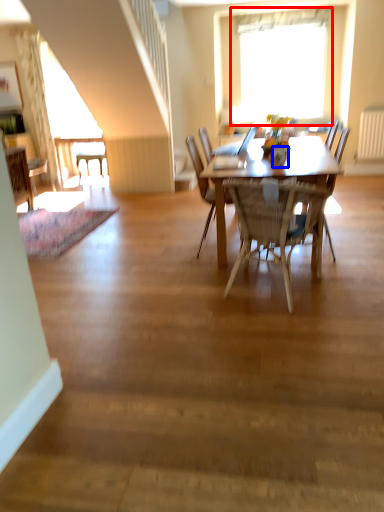
Question: Which object appears farthest to the camera in this image, window (highlighted by a red box) or vase (highlighted by a blue box)?

Choices:
 (A) window
 (B) vase

Answer: (A)